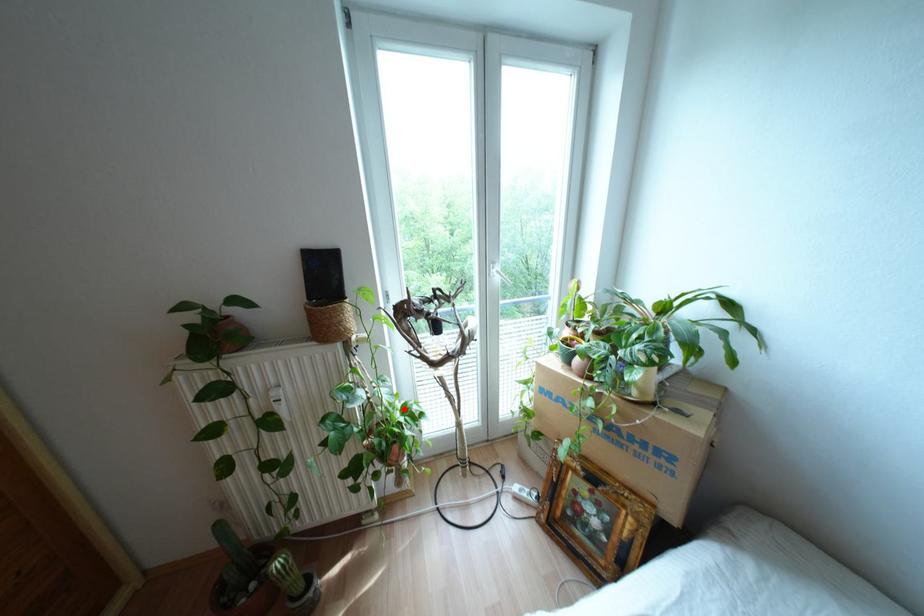
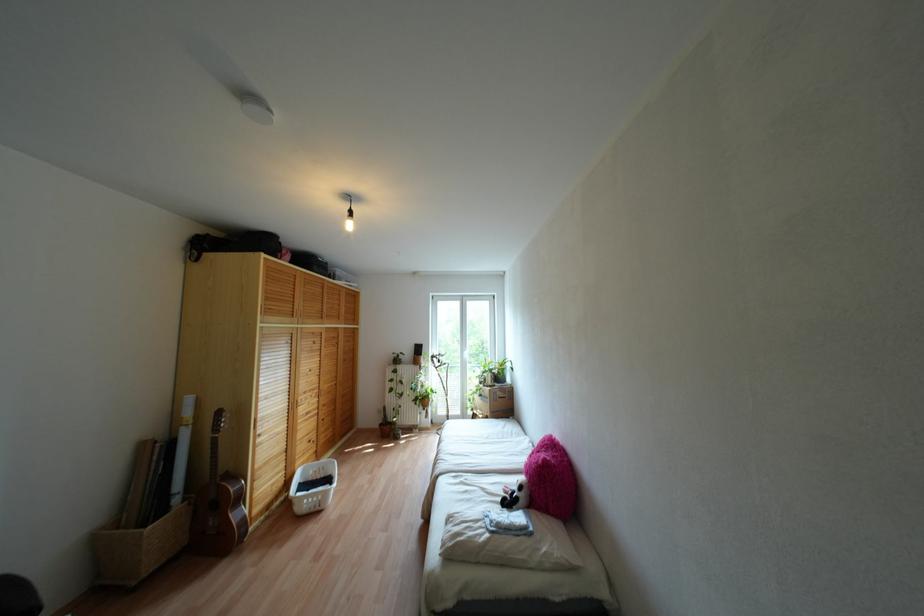
In the second image, find the point that corresponds to the highlighted location in the first image.

(431, 389)